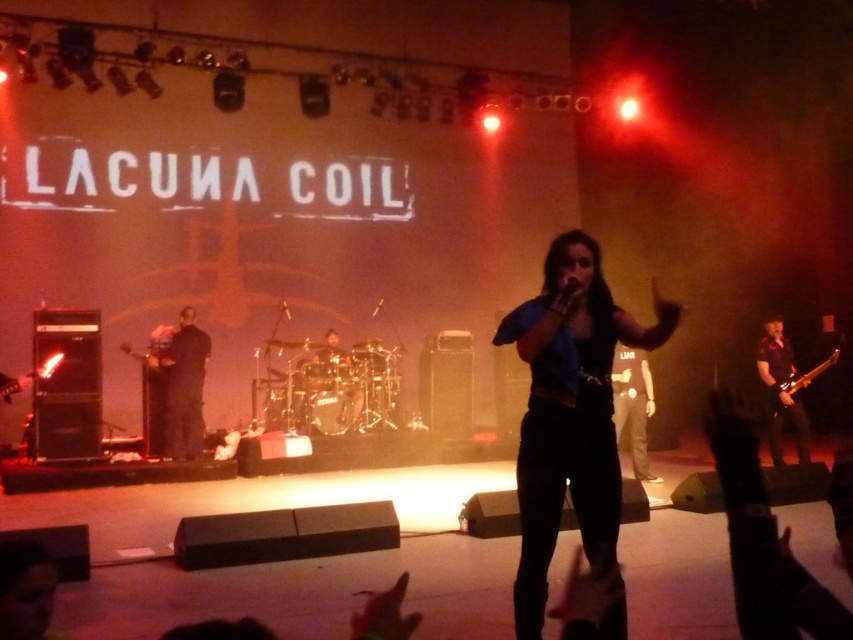
You are a photographer at the Lacuna Coil concert. You want to capture a photo where the blue fabric shirt at center and the shiny metallic guitar at right are both visible. Based on their sizes in the image, which object should you focus on first to ensure both are in frame?

The blue fabric shirt at center is taller than the shiny metallic guitar at right, so focusing on the blue fabric shirt at center first will help ensure both are in frame since it takes up more vertical space.

You are a photographer at the Lacuna Coil concert. You want to capture a photo where both the blue fabric shirt at center and the shiny metallic guitar at right are clearly visible. Based on their positions, which object is closer to the camera, making it easier to focus on both?

The blue fabric shirt at center is positioned over the shiny metallic guitar at right, meaning it is closer to the camera. By focusing on the blue fabric shirt at center, both objects will be in clear view since the shirt is in front.

You are a photographer at the concert and need to frame a shot that includes both the blue fabric shirt at center and the shiny metallic guitar at right. Given that the shirt is narrower, will it be easier to fit both into the frame without cropping either object?

The blue fabric shirt at center has a lesser width compared to the shiny metallic guitar at right, so it will be easier to fit both into the frame without cropping since the shirt takes up less horizontal space.